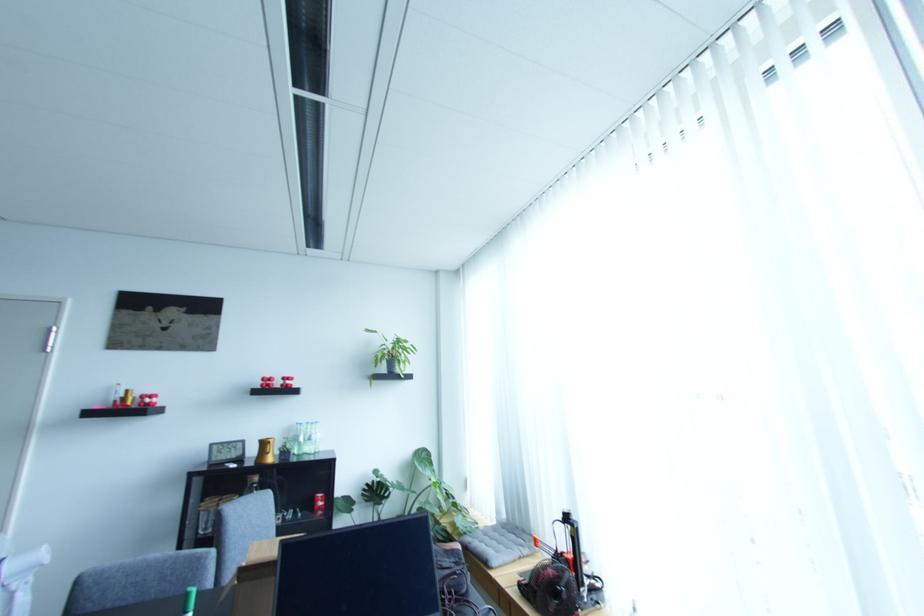
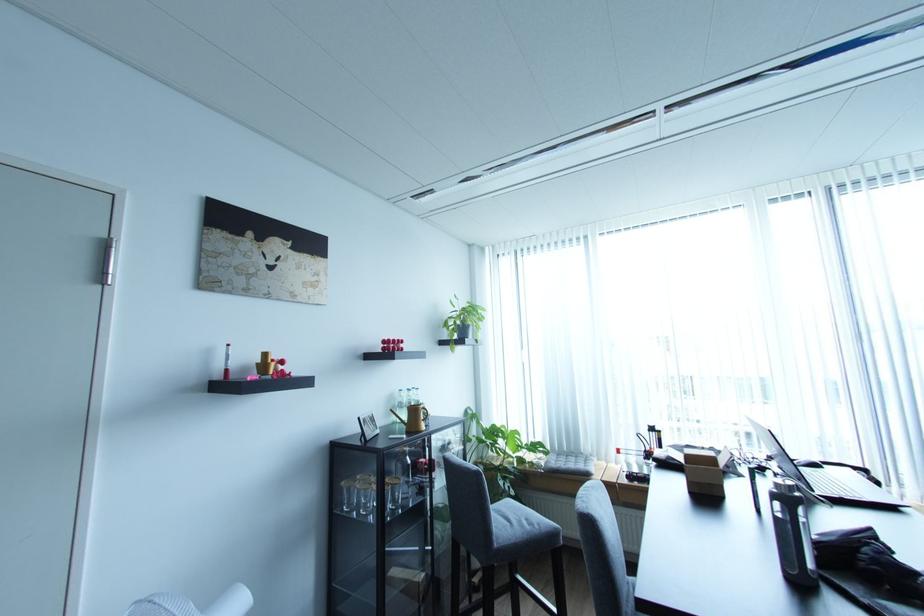
In the second image, find the point that corresponds to (x=273, y=451) in the first image.

(426, 418)